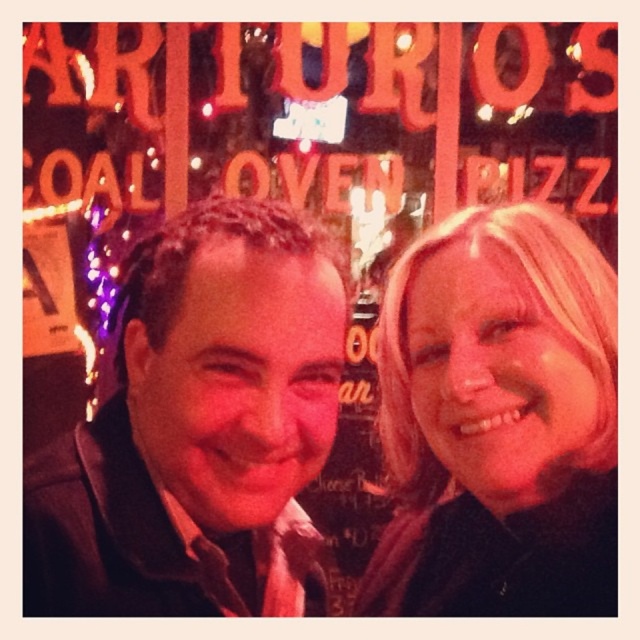
You are a photographer trying to frame a shot that includes both the matte black jacket at center and the blonde hair at upper right. Which object should you adjust your camera angle to prioritize if you want to focus on the wider one?

The matte black jacket at center is wider than the blonde hair at upper right, so prioritize focusing on the matte black jacket at center.

You are a photographer setting up for a group photo. You notice the matte black jacket at center and the blonde hair at upper right. Which object is positioned to the left of the other?

The matte black jacket at center is positioned to the left of the blonde hair at upper right.

You are a photographer trying to capture a closeup of the matte black jacket at center. Based on its coordinates, where should you aim your camera?

The matte black jacket at center is located at coordinates point (x=195, y=424), so aim your camera there to capture the closeup.